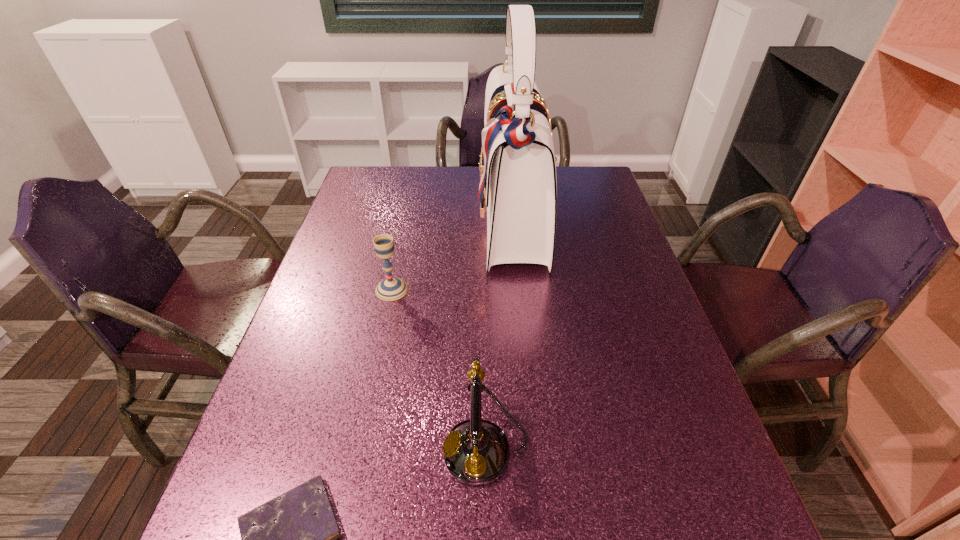
Image resolution: width=960 pixels, height=540 pixels. I want to click on free space between the chalice and the satchel, so click(x=453, y=255).

This screenshot has height=540, width=960. Identify the location of vacant point located between the satchel and the telephone. (500, 335).

Locate an element on the screen. This screenshot has width=960, height=540. unoccupied area between the satchel and the chalice is located at coordinates (453, 255).

This screenshot has width=960, height=540. I want to click on the second closest object relative to the telephone, so click(x=392, y=288).

Locate an element on the screen. the third closest object to the satchel is located at coordinates (290, 539).